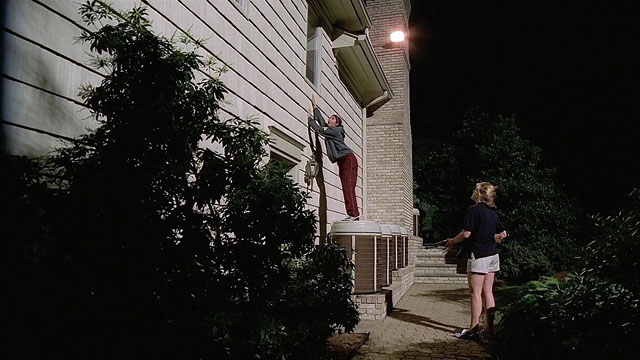
You are a GUI agent. You are given a task and a screenshot of the screen. Output one action in this format:
    pyautogui.click(x=<x>, y=<y>)
    Task: Click on the ac unit
    
    Given the screenshot: What is the action you would take?
    pyautogui.click(x=362, y=257), pyautogui.click(x=388, y=253), pyautogui.click(x=396, y=249), pyautogui.click(x=406, y=249)